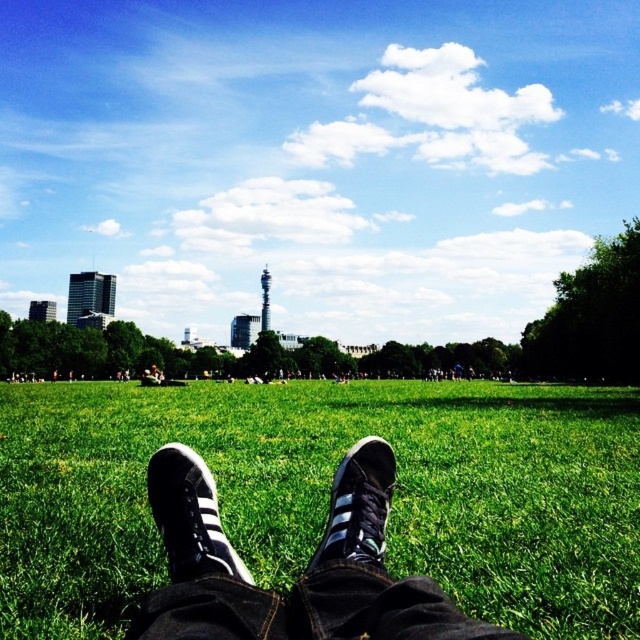
Is green grass at center taller than black suede sneaker at lower center?

Correct, green grass at center is much taller as black suede sneaker at lower center.

Is green grass at center thinner than black suede sneaker at lower center?

No, green grass at center is not thinner than black suede sneaker at lower center.

Who is more forward, (477, 545) or (225, 566)?

Point (225, 566) is more forward.

Find the location of a particular element. green grass at center is located at coordinates (326, 493).

Is point (224, 580) closer to camera compared to point (384, 468)?

Yes, point (224, 580) is closer to viewer.

Between black suede sneakers at center and black suede shoe at center, which one appears on the left side from the viewer's perspective?

From the viewer's perspective, black suede sneakers at center appears more on the left side.

Where is `black suede sneakers at center`? black suede sneakers at center is located at coordinates (304, 572).

Between black suede sneakers at center and black suede sneaker at lower center, which one appears on the right side from the viewer's perspective?

Positioned to the right is black suede sneakers at center.

Who is higher up, black suede sneakers at center or black suede sneaker at lower center?

black suede sneaker at lower center

Identify the location of black suede sneakers at center. This screenshot has width=640, height=640. (304, 572).